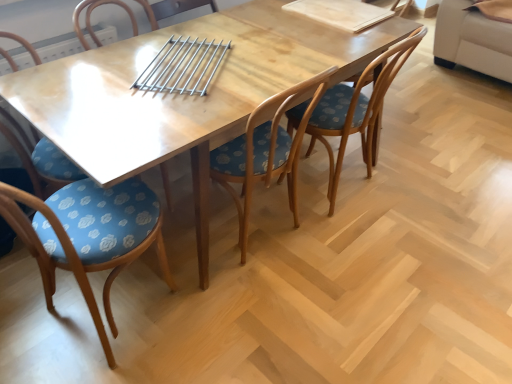
Question: Which direction should I rotate to look at wooden chair with floral cushion at center, acting as the third chair starting from the left?

Choices:
 (A) left
 (B) right

Answer: (B)

Question: Can you confirm if wooden table at center is shorter than wooden chair with floral cushion at center, acting as the 1th chair starting from the right?

Choices:
 (A) no
 (B) yes

Answer: (B)

Question: From a real-world perspective, is wooden table at center under wooden chair with floral cushion at center, acting as the 1th chair starting from the right?

Choices:
 (A) yes
 (B) no

Answer: (A)

Question: Is wooden table at center completely or partially outside of wooden chair with floral cushion at center, positioned as the fourth chair in left-to-right order?

Choices:
 (A) yes
 (B) no

Answer: (A)

Question: Does wooden table at center have a larger size compared to wooden chair with floral cushion at center, positioned as the fourth chair in left-to-right order?

Choices:
 (A) no
 (B) yes

Answer: (B)

Question: Does wooden table at center have a smaller size compared to wooden chair with floral cushion at center, positioned as the fourth chair in left-to-right order?

Choices:
 (A) yes
 (B) no

Answer: (B)

Question: Is wooden table at center further to camera compared to wooden chair with floral cushion at center, positioned as the fourth chair in left-to-right order?

Choices:
 (A) no
 (B) yes

Answer: (A)

Question: Could you tell me if wooden chair with floral cushion at center, acting as the third chair starting from the left, is facing blue floral fabric chair at lower left, which is the 1th chair from left to right?

Choices:
 (A) no
 (B) yes

Answer: (A)

Question: From the image's perspective, would you say wooden chair with floral cushion at center, the second chair in the right-to-left sequence, is positioned over blue floral fabric chair at lower left, the 4th chair positioned from the right?

Choices:
 (A) no
 (B) yes

Answer: (B)

Question: Is wooden chair with floral cushion at center, acting as the third chair starting from the left, smaller than blue floral fabric chair at lower left, the 4th chair positioned from the right?

Choices:
 (A) yes
 (B) no

Answer: (B)

Question: Can we say wooden chair with floral cushion at center, the second chair in the right-to-left sequence, lies outside blue floral fabric chair at lower left, which is the 1th chair from left to right?

Choices:
 (A) no
 (B) yes

Answer: (B)

Question: Can you confirm if wooden chair with floral cushion at center, the second chair in the right-to-left sequence, is positioned to the left of blue floral fabric chair at lower left, which is the 1th chair from left to right?

Choices:
 (A) no
 (B) yes

Answer: (A)

Question: Does wooden chair with floral cushion at center, acting as the third chair starting from the left, have a greater height compared to blue floral fabric chair at lower left, which is the 1th chair from left to right?

Choices:
 (A) no
 (B) yes

Answer: (B)

Question: Does blue floral fabric chair at lower left, which is the 1th chair from left to right, have a lesser height compared to wooden table at center?

Choices:
 (A) no
 (B) yes

Answer: (A)